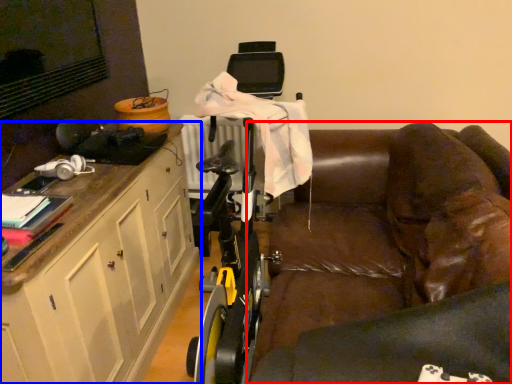
Question: Which of the following is the farthest to the observer, studio couch (highlighted by a red box) or cabinetry (highlighted by a blue box)?

Choices:
 (A) studio couch
 (B) cabinetry

Answer: (B)